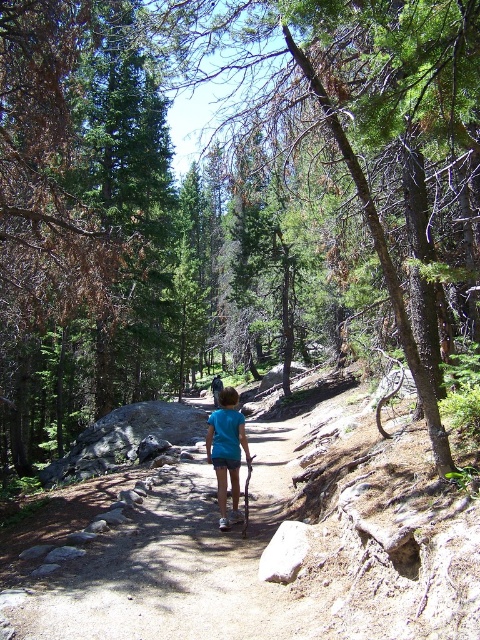
Does blue cotton shirt at center lie in front of blue fabric shirt at center?

Yes, it is.

Which is more to the right, blue cotton shirt at center or blue fabric shirt at center?

blue cotton shirt at center

The image size is (480, 640). I want to click on blue cotton shirt at center, so click(227, 451).